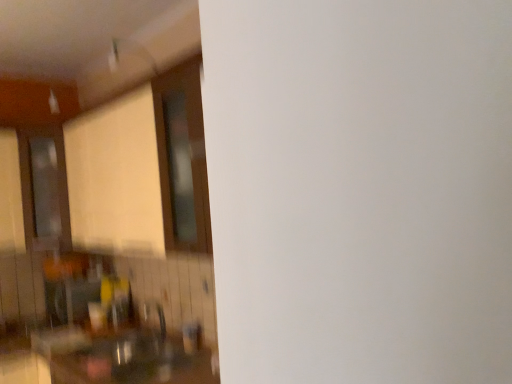
The height and width of the screenshot is (384, 512). What do you see at coordinates (121, 358) in the screenshot? I see `matte brown countertop at lower left` at bounding box center [121, 358].

This screenshot has width=512, height=384. I want to click on matte brown countertop at lower left, so click(x=121, y=358).

Locate an element on the screen. matte brown countertop at lower left is located at coordinates (121, 358).